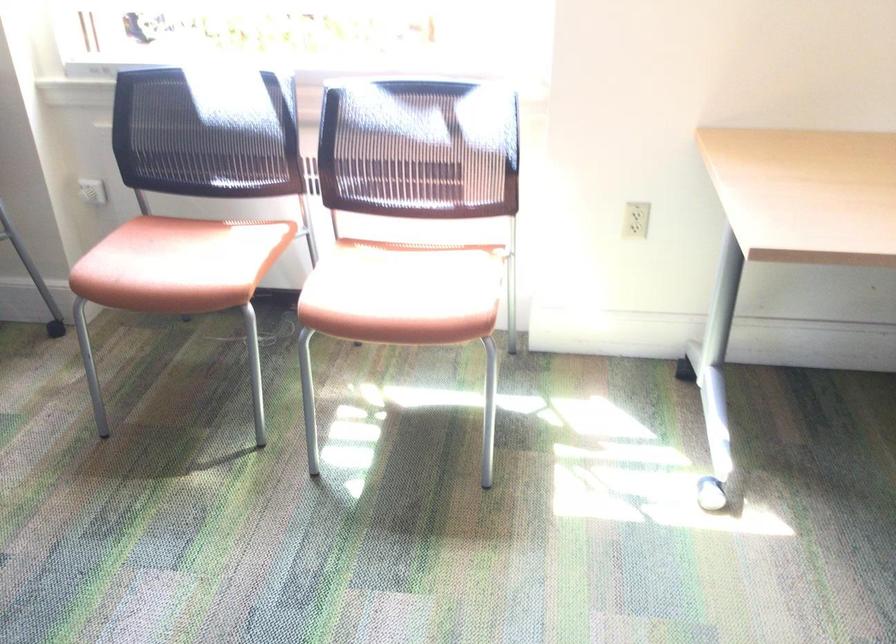
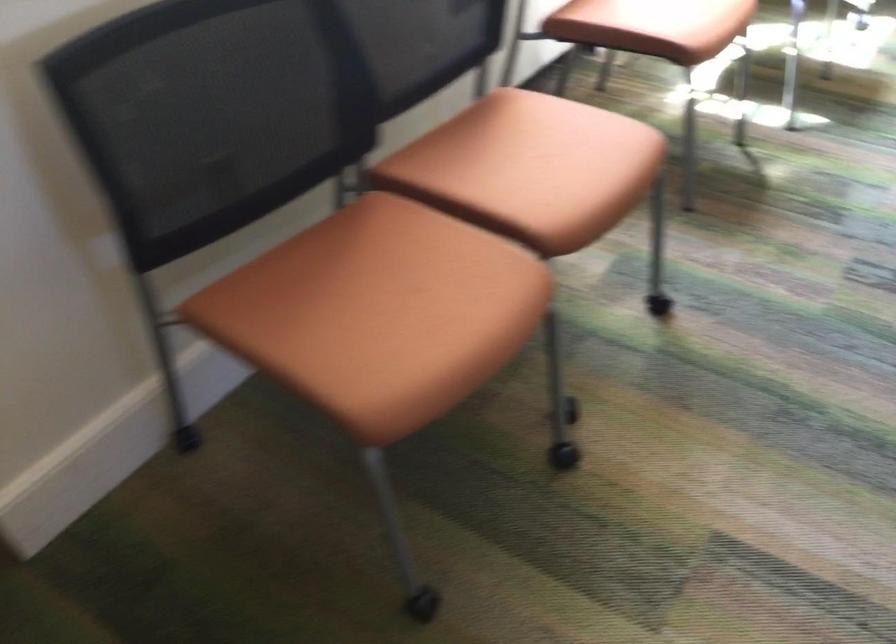
The point at [132,270] is marked in the first image. Where is the corresponding point in the second image?

(684, 23)